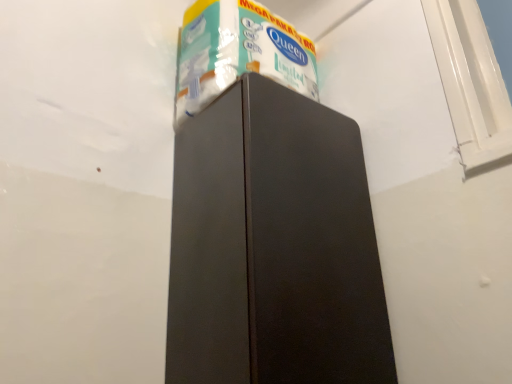
What do you see at coordinates (238, 52) in the screenshot? I see `white glossy toilet paper at upper center` at bounding box center [238, 52].

The width and height of the screenshot is (512, 384). I want to click on white glossy toilet paper at upper center, so 238,52.

The width and height of the screenshot is (512, 384). Identify the location of matte black refrigerator at center. (274, 246).

The height and width of the screenshot is (384, 512). What do you see at coordinates (274, 246) in the screenshot?
I see `matte black refrigerator at center` at bounding box center [274, 246].

The width and height of the screenshot is (512, 384). Find the location of `white glossy toilet paper at upper center`. white glossy toilet paper at upper center is located at coordinates (238, 52).

Considering the relative positions of white glossy toilet paper at upper center and matte black refrigerator at center in the image provided, is white glossy toilet paper at upper center to the left of matte black refrigerator at center from the viewer's perspective?

Correct, you'll find white glossy toilet paper at upper center to the left of matte black refrigerator at center.

In the image, is white glossy toilet paper at upper center positioned in front of or behind matte black refrigerator at center?

In the image, white glossy toilet paper at upper center appears behind matte black refrigerator at center.

Is point (285, 30) closer to viewer compared to point (183, 343)?

No, (285, 30) is behind (183, 343).

From the image's perspective, is white glossy toilet paper at upper center on matte black refrigerator at center?

Indeed, from the image's perspective, white glossy toilet paper at upper center is shown above matte black refrigerator at center.

From a real-world perspective, which object stands above the other?

white glossy toilet paper at upper center.

Between white glossy toilet paper at upper center and matte black refrigerator at center, which one has smaller width?

white glossy toilet paper at upper center.

Who is taller, white glossy toilet paper at upper center or matte black refrigerator at center?

Standing taller between the two is matte black refrigerator at center.

Considering the relative sizes of white glossy toilet paper at upper center and matte black refrigerator at center in the image provided, is white glossy toilet paper at upper center smaller than matte black refrigerator at center?

Yes.

Choose the correct answer: Is white glossy toilet paper at upper center inside matte black refrigerator at center or outside it?

white glossy toilet paper at upper center is spatially situated outside matte black refrigerator at center.

Is the surface of white glossy toilet paper at upper center in direct contact with matte black refrigerator at center?

No, white glossy toilet paper at upper center is not touching matte black refrigerator at center.

In the scene shown: Is white glossy toilet paper at upper center oriented towards matte black refrigerator at center?

No, white glossy toilet paper at upper center is not turned towards matte black refrigerator at center.

How many degrees apart are the facing directions of white glossy toilet paper at upper center and matte black refrigerator at center?

1.27 degrees separate the facing orientations of white glossy toilet paper at upper center and matte black refrigerator at center.

Based on the photo, how far apart are white glossy toilet paper at upper center and matte black refrigerator at center?

white glossy toilet paper at upper center is 13.23 inches away from matte black refrigerator at center.

In order to click on refrigerator lying below the white glossy toilet paper at upper center (from the image's perspective) in this screenshot , I will do `click(274, 246)`.

Does matte black refrigerator at center appear on the right side of white glossy toilet paper at upper center?

Indeed, matte black refrigerator at center is positioned on the right side of white glossy toilet paper at upper center.

Is matte black refrigerator at center positioned behind white glossy toilet paper at upper center?

No, it is in front of white glossy toilet paper at upper center.

Is point (313, 264) less distant than point (293, 65)?

Yes, point (313, 264) is closer to viewer.

Consider the image. From the image's perspective, is matte black refrigerator at center below white glossy toilet paper at upper center?

Yes, from the image's perspective, matte black refrigerator at center is beneath white glossy toilet paper at upper center.

From a real-world perspective, is matte black refrigerator at center physically above white glossy toilet paper at upper center?

No, from a real-world perspective, matte black refrigerator at center is not over white glossy toilet paper at upper center

Is matte black refrigerator at center thinner than white glossy toilet paper at upper center?

No, matte black refrigerator at center is not thinner than white glossy toilet paper at upper center.

Which of these two, matte black refrigerator at center or white glossy toilet paper at upper center, stands taller?

With more height is matte black refrigerator at center.

Which of these two, matte black refrigerator at center or white glossy toilet paper at upper center, is smaller?

With smaller size is white glossy toilet paper at upper center.

Would you say matte black refrigerator at center contains white glossy toilet paper at upper center?

Actually, white glossy toilet paper at upper center is outside matte black refrigerator at center.

Can you see matte black refrigerator at center touching white glossy toilet paper at upper center?

No, matte black refrigerator at center is not next to white glossy toilet paper at upper center.

Could you tell me if matte black refrigerator at center is turned towards white glossy toilet paper at upper center?

No, matte black refrigerator at center does not turn towards white glossy toilet paper at upper center.

How different are the orientations of matte black refrigerator at center and white glossy toilet paper at upper center in degrees?

matte black refrigerator at center and white glossy toilet paper at upper center are facing 1.27 degrees away from each other.

In the scene shown: How far apart are matte black refrigerator at center and white glossy toilet paper at upper center?

matte black refrigerator at center is 13.23 inches from white glossy toilet paper at upper center.

Locate an element on the screen. The width and height of the screenshot is (512, 384). refrigerator below the white glossy toilet paper at upper center (from a real-world perspective) is located at coordinates (274, 246).

What are the coordinates of `toilet paper located on the left of matte black refrigerator at center` in the screenshot? It's located at (238, 52).

The image size is (512, 384). I want to click on refrigerator below the white glossy toilet paper at upper center (from the image's perspective), so click(274, 246).